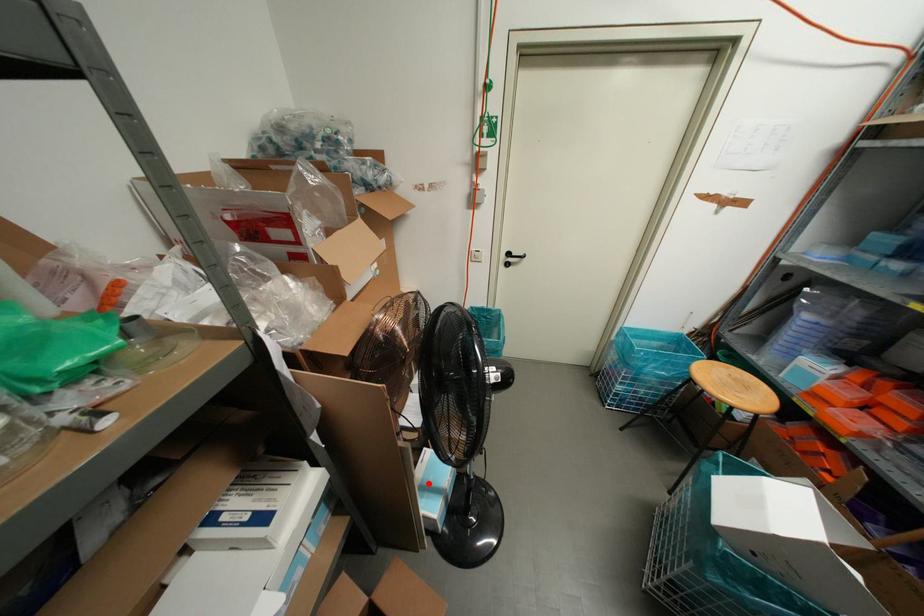
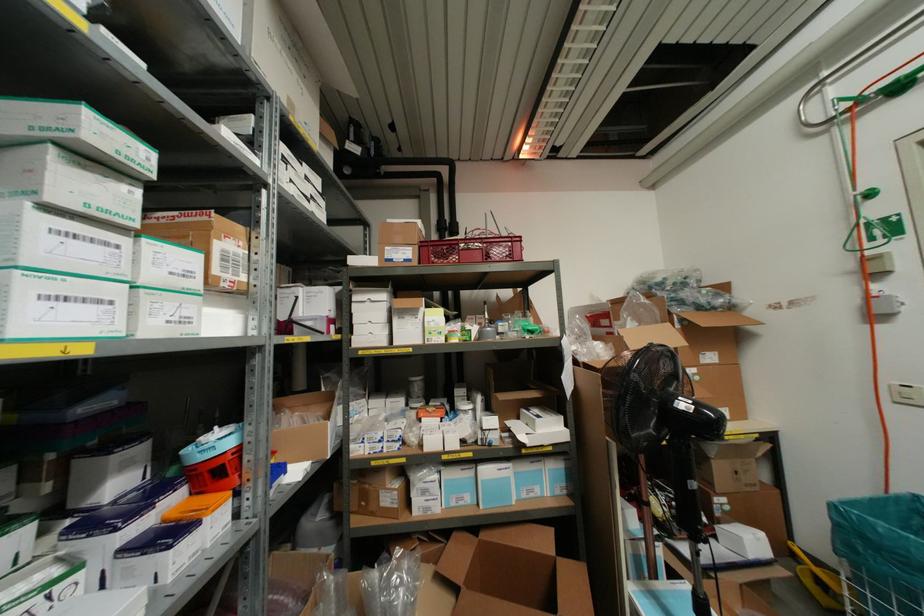
Find the pixel in the second image that matches the highlighted location in the first image.

(663, 601)